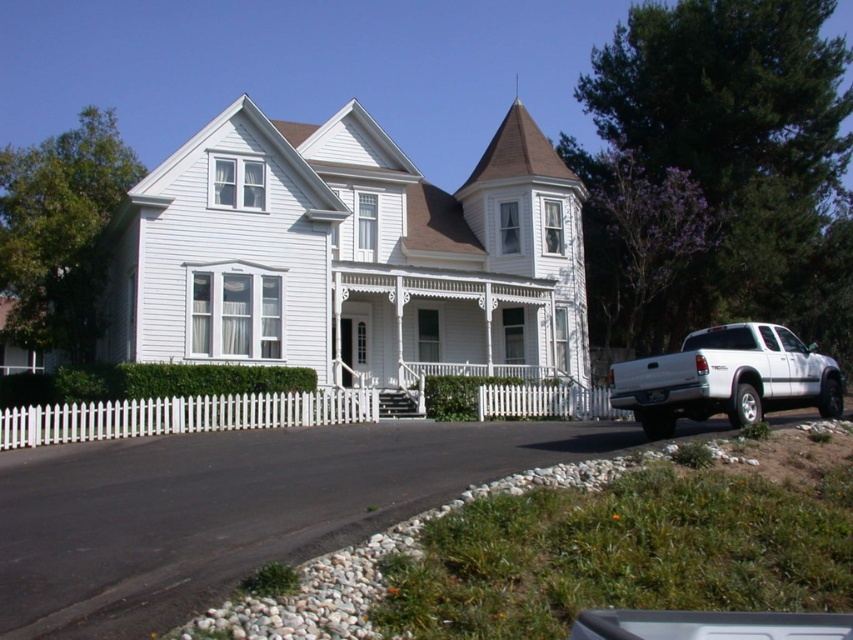
How distant is white matte truck at lower right from white picket fence at center?

The distance of white matte truck at lower right from white picket fence at center is 46.21 feet.

In the scene shown: Is white matte truck at lower right further to the viewer compared to white picket fence at center?

No.

Does point (624, 403) lie behind point (123, 426)?

No.

I want to click on white matte truck at lower right, so 727,378.